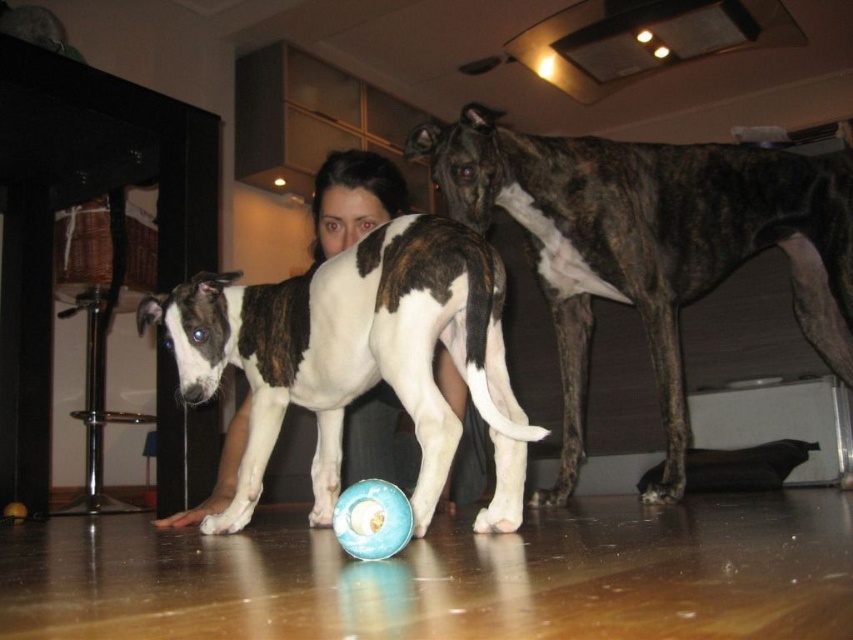
Does point (468, 380) come in front of point (344, 502)?

No, (468, 380) is behind (344, 502).

Is brown and white fur at center closer to camera compared to blue rubber ball at center?

No, brown and white fur at center is further to the viewer.

Image resolution: width=853 pixels, height=640 pixels. Find the location of `brown and white fur at center`. brown and white fur at center is located at coordinates (357, 356).

Is point (450, 204) positioned before point (364, 282)?

That is False.

Where is `brindle fur dog at center`? This screenshot has width=853, height=640. brindle fur dog at center is located at coordinates (650, 244).

Who is more forward, (660,182) or (451,320)?

Positioned in front is point (451,320).

Image resolution: width=853 pixels, height=640 pixels. I want to click on brindle fur dog at center, so click(650, 244).

Is brindle fur dog at center to the right of blue rubber ball at center from the viewer's perspective?

Correct, you'll find brindle fur dog at center to the right of blue rubber ball at center.

Does point (636, 163) come in front of point (332, 518)?

No, it is behind (332, 518).

Image resolution: width=853 pixels, height=640 pixels. I want to click on brindle fur dog at center, so click(650, 244).